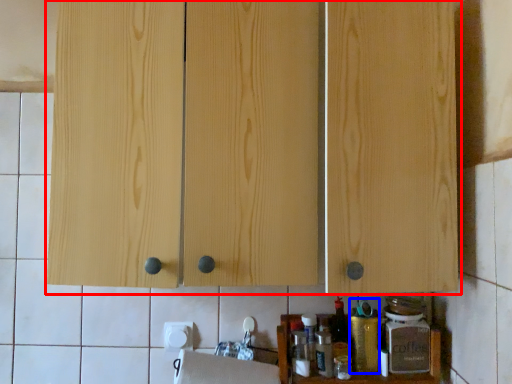
Question: Which object appears farthest to the camera in this image, cabinetry (highlighted by a red box) or bottle (highlighted by a blue box)?

Choices:
 (A) cabinetry
 (B) bottle

Answer: (B)